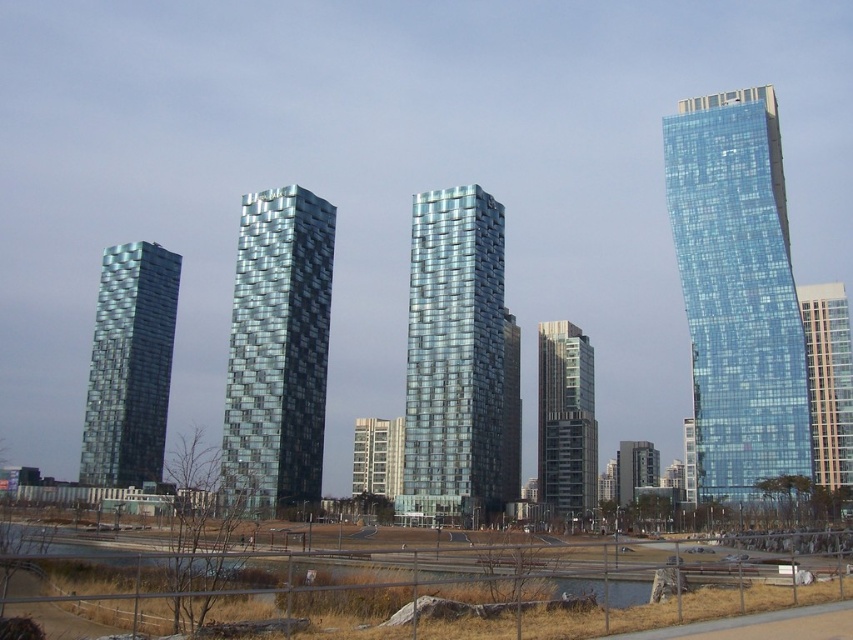
Question: Can you confirm if shiny glass skyscraper at left is thinner than white concrete building at center?

Choices:
 (A) yes
 (B) no

Answer: (B)

Question: Which of the following is the closest to the observer?

Choices:
 (A) shiny glass skyscraper at left
 (B) transparent glass skyscraper at right
 (C) shiny glass skyscraper at center

Answer: (B)

Question: Which of these objects is positioned farthest from the shiny glass skyscraper at center?

Choices:
 (A) metallic glass tower at center
 (B) matte glass building at center
 (C) clear glass building at right
 (D) shiny glass skyscraper at left

Answer: (D)

Question: Can you confirm if shiny glass skyscraper at center is positioned to the left of matte glass building at center?

Choices:
 (A) yes
 (B) no

Answer: (A)

Question: Which point is farther to the camera?

Choices:
 (A) clear glass building at right
 (B) shiny glass skyscraper at center

Answer: (B)

Question: Is shiny glass skyscraper at center to the left of metallic glass tower at center from the viewer's perspective?

Choices:
 (A) no
 (B) yes

Answer: (A)